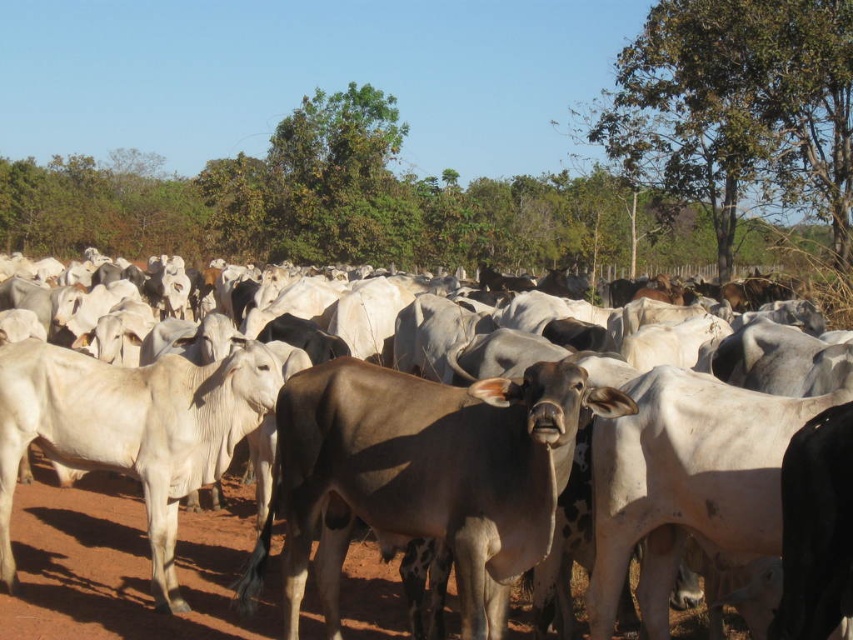
Between green leafy tree at upper right and white smooth cows at center, which one appears on the right side from the viewer's perspective?

From the viewer's perspective, green leafy tree at upper right appears more on the right side.

Which is behind, point (685, 145) or point (57, 582)?

The point (685, 145) is behind.

The image size is (853, 640). Identify the location of green leafy tree at upper right. (738, 109).

Who is taller, brown smooth cow at center or green leafy tree at upper right?

green leafy tree at upper right

Does brown smooth cow at center have a lesser width compared to green leafy tree at upper right?

Yes.

What do you see at coordinates (421, 476) in the screenshot? Image resolution: width=853 pixels, height=640 pixels. I see `brown smooth cow at center` at bounding box center [421, 476].

Find the location of a particular element. This screenshot has width=853, height=640. brown smooth cow at center is located at coordinates (421, 476).

Is brown smooth cow at center bigger than white smooth cows at center?

Correct, brown smooth cow at center is larger in size than white smooth cows at center.

Who is more forward, (550, 429) or (381, 586)?

Point (550, 429) is in front.

This screenshot has width=853, height=640. Find the location of `brown smooth cow at center`. brown smooth cow at center is located at coordinates 421,476.